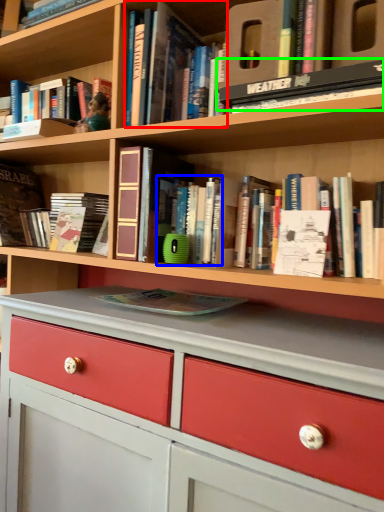
Question: Which is nearer to the book (highlighted by a red box)? book (highlighted by a blue box) or book (highlighted by a green box).

Choices:
 (A) book
 (B) book

Answer: (B)